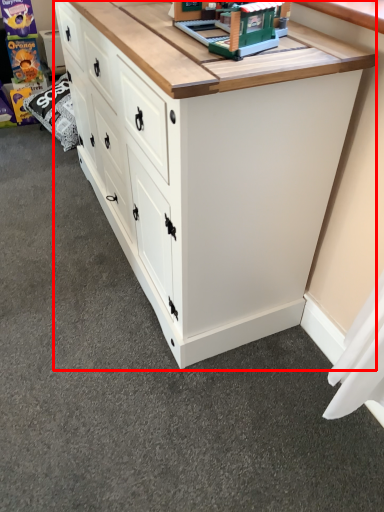
Question: From the image's perspective, what is the correct spatial relationship of chest of drawers (annotated by the red box) in relation to toy?

Choices:
 (A) below
 (B) above

Answer: (A)